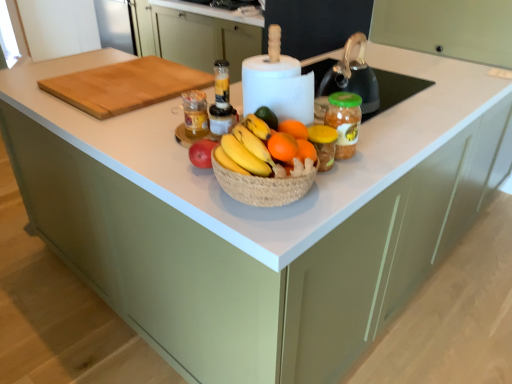
Question: Relative to orangesmoothfruit at center, is translucent plastic blender at center, the 1th bottle when ordered from right to left, in front or behind?

Choices:
 (A) front
 (B) behind

Answer: (B)

Question: Would you say translucent plastic blender at center, which is the 2th bottle in left-to-right order, is inside or outside orangesmoothfruit at center?

Choices:
 (A) outside
 (B) inside

Answer: (A)

Question: Considering the real-world distances, which object is farthest from the orangesmoothfruit at center?

Choices:
 (A) translucent glass jar at center, the 2th bottle viewed from the right
 (B) orange matte grapefruit at center
 (C) green plastic jar at center
 (D) translucent plastic blender at center, which is the 2th bottle in left-to-right order
 (E) natural wood cutting board at upper left

Answer: (E)

Question: Based on their relative distances, which object is nearer to the orange matte grapefruit at center?

Choices:
 (A) translucent plastic blender at center, the 1th bottle when ordered from right to left
 (B) green plastic jar at center
 (C) translucent glass jar at center, marked as the 1th bottle in a left-to-right arrangement
 (D) orangesmoothfruit at center
 (E) natural wood cutting board at upper left

Answer: (D)